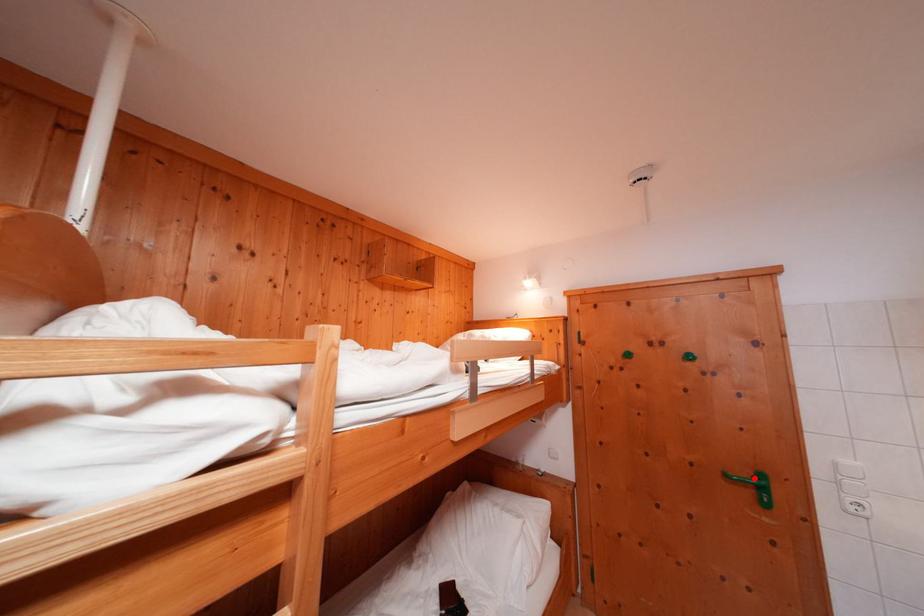
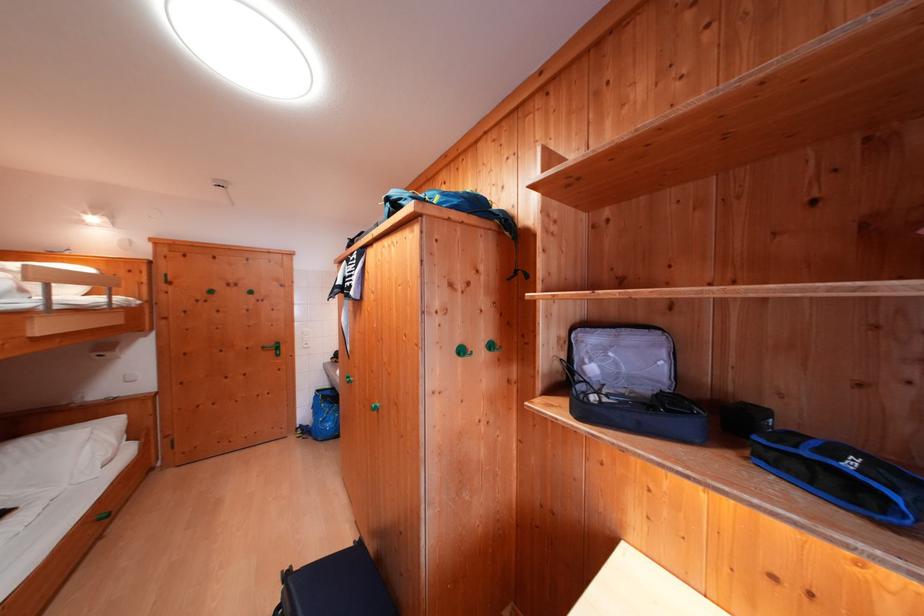
Question: I am providing you with two images of the same scene from different viewpoints. Image1 has a red point marked. In image2, the corresponding 3D location appears at what relative position? Reply with the corresponding letter.

Choices:
 (A) Closer
 (B) Farther

Answer: (B)